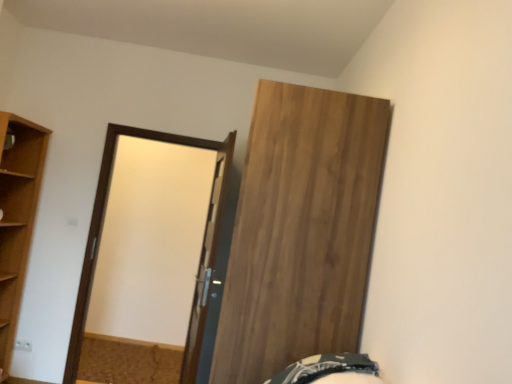
Identify the location of matte brown door at center. 102,225.

I want to click on white glossy door at center, which ranks as the 1th door in left-to-right order, so click(206, 256).

Find the location of a particular element. The width and height of the screenshot is (512, 384). wooden door at upper right, marked as the second door in a left-to-right arrangement is located at coordinates [301, 230].

Locate an element on the screen. The image size is (512, 384). matte brown door at center is located at coordinates coord(102,225).

Is white glossy door at center, which is the second door in right-to-left order, inside the boundaries of light brown wood at left, or outside?

Answer: white glossy door at center, which is the second door in right-to-left order, is not inside light brown wood at left, it's outside.

Is white glossy door at center, which is the second door in right-to-left order, far from light brown wood at left?

white glossy door at center, which is the second door in right-to-left order, is far away from light brown wood at left.

Does white glossy door at center, which is the second door in right-to-left order, have a lesser width compared to light brown wood at left?

Correct, the width of white glossy door at center, which is the second door in right-to-left order, is less than that of light brown wood at left.

Is white glossy door at center, which is the second door in right-to-left order, oriented away from light brown wood at left?

No, white glossy door at center, which is the second door in right-to-left order, is not facing away from light brown wood at left.

In the image, is wooden door at upper right, marked as the second door in a left-to-right arrangement, on the left side or the right side of white glossy door at center, which ranks as the 1th door in left-to-right order?

Clearly, wooden door at upper right, marked as the second door in a left-to-right arrangement, is on the right of white glossy door at center, which ranks as the 1th door in left-to-right order, in the image.

From a real-world perspective, which object stands above the other?

wooden door at upper right, the 1th door when ordered from right to left, is physically above.

Is wooden door at upper right, the 1th door when ordered from right to left, closer to camera compared to white glossy door at center, which is the second door in right-to-left order?

Yes, it is.

How many degrees apart are the facing directions of wooden door at upper right, the 1th door when ordered from right to left, and white glossy door at center, which is the second door in right-to-left order?

1.16 degrees.

Can you confirm if dark green fabric bed at lower right is wider than wooden door at upper right, the 1th door when ordered from right to left?

No, dark green fabric bed at lower right is not wider than wooden door at upper right, the 1th door when ordered from right to left.

In the image, there is a wooden door at upper right, the 1th door when ordered from right to left. Where is `bed below it (from a real-world perspective)`? Image resolution: width=512 pixels, height=384 pixels. bed below it (from a real-world perspective) is located at coordinates (325, 368).

Which object is positioned more to the left, dark green fabric bed at lower right or wooden door at upper right, the 1th door when ordered from right to left?

From the viewer's perspective, wooden door at upper right, the 1th door when ordered from right to left, appears more on the left side.

The image size is (512, 384). I want to click on cupboard lying behind the wooden door at upper right, marked as the second door in a left-to-right arrangement, so click(x=17, y=217).

From the image's perspective, which one is positioned lower, wooden door at upper right, marked as the second door in a left-to-right arrangement, or light brown wood at left?

From the image's view, wooden door at upper right, marked as the second door in a left-to-right arrangement, is below.

Would you say wooden door at upper right, the 1th door when ordered from right to left, contains light brown wood at left?

No, light brown wood at left is not surrounded by wooden door at upper right, the 1th door when ordered from right to left.

Between matte brown door at center and wooden door at upper right, the 1th door when ordered from right to left, which one has larger width?

wooden door at upper right, the 1th door when ordered from right to left.

Would you say wooden door at upper right, the 1th door when ordered from right to left, is part of matte brown door at center's contents?

No, wooden door at upper right, the 1th door when ordered from right to left, is not surrounded by matte brown door at center.

Consider the image. Does matte brown door at center appear on the right side of wooden door at upper right, marked as the second door in a left-to-right arrangement?

No, matte brown door at center is not to the right of wooden door at upper right, marked as the second door in a left-to-right arrangement.

Looking at this image, is matte brown door at center far away from wooden door at upper right, marked as the second door in a left-to-right arrangement?

matte brown door at center is positioned a significant distance from wooden door at upper right, marked as the second door in a left-to-right arrangement.

Between wooden door at upper right, marked as the second door in a left-to-right arrangement, and matte brown door at center, which one has larger size?

With larger size is wooden door at upper right, marked as the second door in a left-to-right arrangement.

Is wooden door at upper right, marked as the second door in a left-to-right arrangement, situated inside matte brown door at center or outside?

wooden door at upper right, marked as the second door in a left-to-right arrangement, lies outside matte brown door at center.

In terms of width, does wooden door at upper right, marked as the second door in a left-to-right arrangement, look wider or thinner when compared to matte brown door at center?

Clearly, wooden door at upper right, marked as the second door in a left-to-right arrangement, has more width compared to matte brown door at center.

Could you tell me if light brown wood at left is facing matte brown door at center?

No, light brown wood at left is not oriented towards matte brown door at center.

Based on the photo, from a real-world perspective, is light brown wood at left beneath matte brown door at center?

Yes, from a real-world perspective, light brown wood at left is below matte brown door at center.

From the image's perspective, is light brown wood at left above or below matte brown door at center?

Based on their image positions, light brown wood at left is located above matte brown door at center.

Locate an element on the screen. This screenshot has width=512, height=384. door that is the 1st one above the light brown wood at left (from a real-world perspective) is located at coordinates (206, 256).

You are a GUI agent. You are given a task and a screenshot of the screen. Output one action in this format:
    pyautogui.click(x=<x>, y=<y>)
    Task: Click on the door that appears below the wooden door at upper right, the 1th door when ordered from right to left (from the image's perspective)
    The height and width of the screenshot is (384, 512).
    Given the screenshot: What is the action you would take?
    pyautogui.click(x=206, y=256)

Considering their positions, is wooden door at upper right, marked as the second door in a left-to-right arrangement, positioned closer to dark green fabric bed at lower right than light brown wood at left?

wooden door at upper right, marked as the second door in a left-to-right arrangement, lies closer to dark green fabric bed at lower right than the other object.

Looking at the image, which one is located further to wooden door at upper right, marked as the second door in a left-to-right arrangement, matte brown door at center or white glossy door at center, which ranks as the 1th door in left-to-right order?

matte brown door at center lies further to wooden door at upper right, marked as the second door in a left-to-right arrangement, than the other object.

Looking at the image, which one is located closer to light brown wood at left, matte brown door at center or dark green fabric bed at lower right?

matte brown door at center is closer to light brown wood at left.

In the scene shown: Based on their spatial positions, is dark green fabric bed at lower right or light brown wood at left closer to wooden door at upper right, the 1th door when ordered from right to left?

dark green fabric bed at lower right is closer to wooden door at upper right, the 1th door when ordered from right to left.

Estimate the real-world distances between objects in this image. Which object is closer to white glossy door at center, which is the second door in right-to-left order, wooden door at upper right, marked as the second door in a left-to-right arrangement, or matte brown door at center?

The object closer to white glossy door at center, which is the second door in right-to-left order, is matte brown door at center.

From the image, which object appears to be nearer to matte brown door at center, dark green fabric bed at lower right or wooden door at upper right, the 1th door when ordered from right to left?

wooden door at upper right, the 1th door when ordered from right to left.

When comparing their distances from wooden door at upper right, the 1th door when ordered from right to left, does matte brown door at center or light brown wood at left seem further?

light brown wood at left is further to wooden door at upper right, the 1th door when ordered from right to left.

Estimate the real-world distances between objects in this image. Which object is closer to dark green fabric bed at lower right, matte brown door at center or wooden door at upper right, the 1th door when ordered from right to left?

wooden door at upper right, the 1th door when ordered from right to left, lies closer to dark green fabric bed at lower right than the other object.

Locate an element on the screen. This screenshot has height=384, width=512. door between light brown wood at left and wooden door at upper right, marked as the second door in a left-to-right arrangement, in the horizontal direction is located at coordinates (206, 256).

I want to click on screen door between light brown wood at left and dark green fabric bed at lower right in the horizontal direction, so click(x=102, y=225).

You are a GUI agent. You are given a task and a screenshot of the screen. Output one action in this format:
    pyautogui.click(x=<x>, y=<y>)
    Task: Click on the screen door located between light brown wood at left and wooden door at upper right, the 1th door when ordered from right to left, in the left-right direction
    
    Given the screenshot: What is the action you would take?
    pyautogui.click(x=102, y=225)

You are a GUI agent. You are given a task and a screenshot of the screen. Output one action in this format:
    pyautogui.click(x=<x>, y=<y>)
    Task: Click on the screen door between light brown wood at left and white glossy door at center, which ranks as the 1th door in left-to-right order, in the horizontal direction
    This screenshot has width=512, height=384.
    Given the screenshot: What is the action you would take?
    point(102,225)